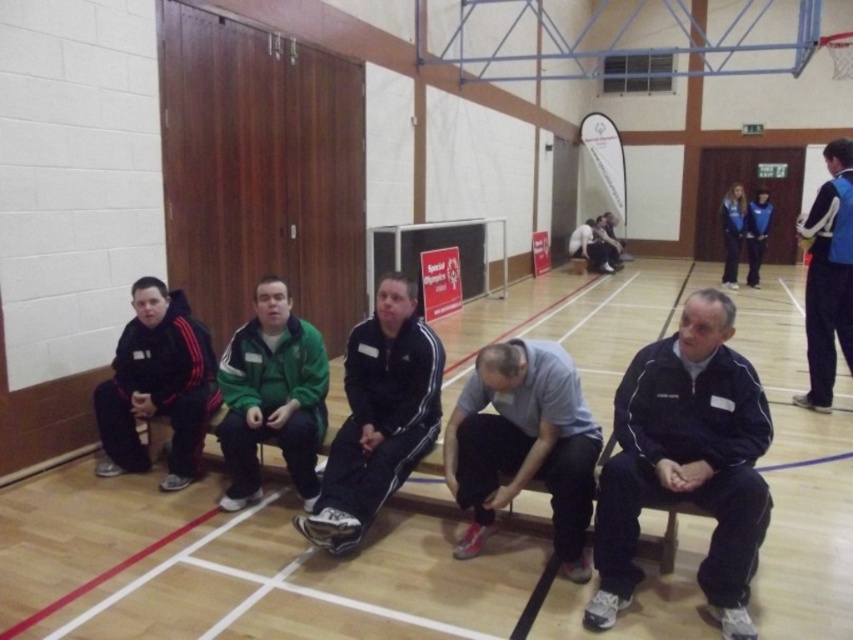
Is black matte jacket at center taller than blue fabric jacket at right?

In fact, black matte jacket at center may be shorter than blue fabric jacket at right.

This screenshot has height=640, width=853. What are the coordinates of `black matte jacket at center` in the screenshot? It's located at (686, 461).

You are a GUI agent. You are given a task and a screenshot of the screen. Output one action in this format:
    pyautogui.click(x=<x>, y=<y>)
    Task: Click on the black matte jacket at center
    This screenshot has height=640, width=853.
    Given the screenshot: What is the action you would take?
    pyautogui.click(x=686, y=461)

Between point (810, 364) and point (733, 211), which one is positioned behind?

The point (733, 211) is behind.

Is blue fabric jacket at right further to the viewer compared to blue fleece jacket at upper right?

No, blue fabric jacket at right is closer to the viewer.

The image size is (853, 640). What are the coordinates of `blue fabric jacket at right` in the screenshot? It's located at (828, 276).

Locate an element on the screen. The width and height of the screenshot is (853, 640). blue fabric jacket at right is located at coordinates (828, 276).

Looking at this image, who is lower down, green fleece jacket at center or black fleece jacket at left?

green fleece jacket at center

Which of these two, green fleece jacket at center or black fleece jacket at left, stands shorter?

Standing shorter between the two is black fleece jacket at left.

What do you see at coordinates (271, 396) in the screenshot? The image size is (853, 640). I see `green fleece jacket at center` at bounding box center [271, 396].

Image resolution: width=853 pixels, height=640 pixels. I want to click on green fleece jacket at center, so click(271, 396).